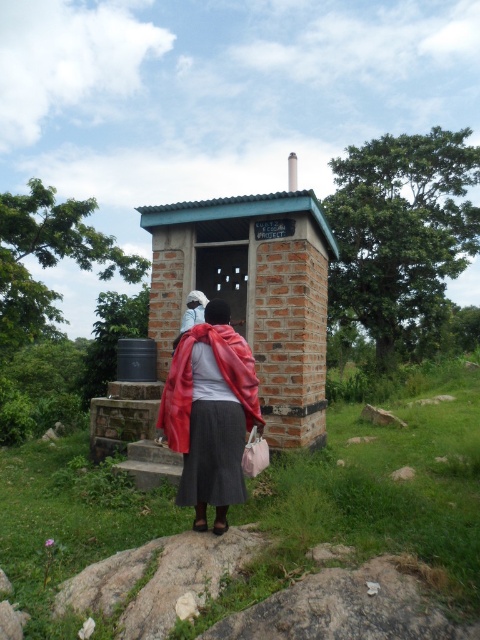
Can you confirm if brick/rough hut at center is shorter than matte red jacket at center?

No.

Is brick/rough hut at center above matte red jacket at center?

Correct, brick/rough hut at center is located above matte red jacket at center.

Identify the location of brick/rough hut at center. Image resolution: width=480 pixels, height=640 pixels. (232, 316).